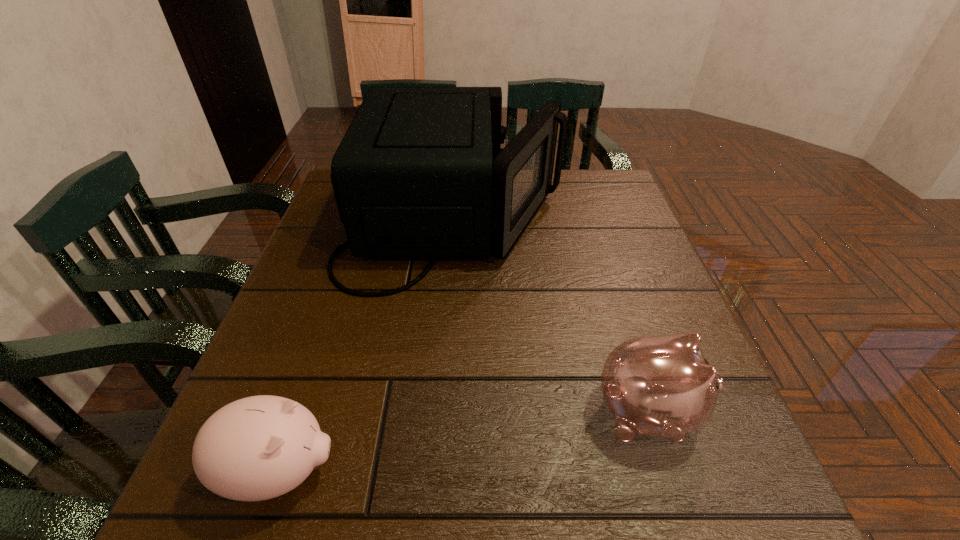
The height and width of the screenshot is (540, 960). Find the location of `object at the right edge`. object at the right edge is located at coordinates (662, 386).

Where is `object that is at the far left corner`? The image size is (960, 540). object that is at the far left corner is located at coordinates (420, 172).

I want to click on object positioned at the near left corner, so click(257, 448).

In the image, there is a desktop. Where is `free space at the far edge`? free space at the far edge is located at coordinates (560, 211).

In the image, there is a desktop. Where is `vacant space at the near edge`? The width and height of the screenshot is (960, 540). vacant space at the near edge is located at coordinates (356, 493).

The height and width of the screenshot is (540, 960). Identify the location of vacant space at the left edge. (318, 325).

This screenshot has height=540, width=960. In the image, there is a desktop. Identify the location of free space at the right edge. 627,238.

Find the location of a particular element. This screenshot has width=960, height=540. vacant space at the near left corner is located at coordinates (220, 515).

Locate an element on the screen. Image resolution: width=960 pixels, height=540 pixels. free region at the far right corner of the desktop is located at coordinates (603, 185).

Locate an element on the screen. vacant space that's between the right piggy bank and the left piggy bank is located at coordinates (465, 442).